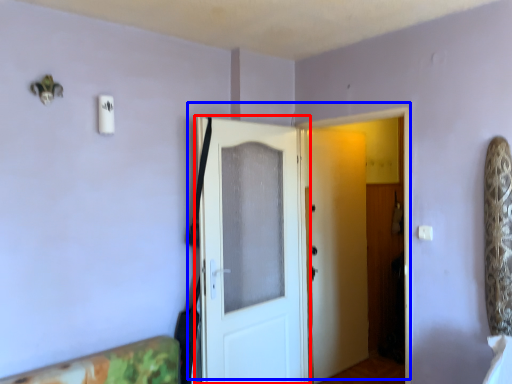
Question: Which object appears closest to the camera in this image, door (highlighted by a red box) or door (highlighted by a blue box)?

Choices:
 (A) door
 (B) door

Answer: (B)